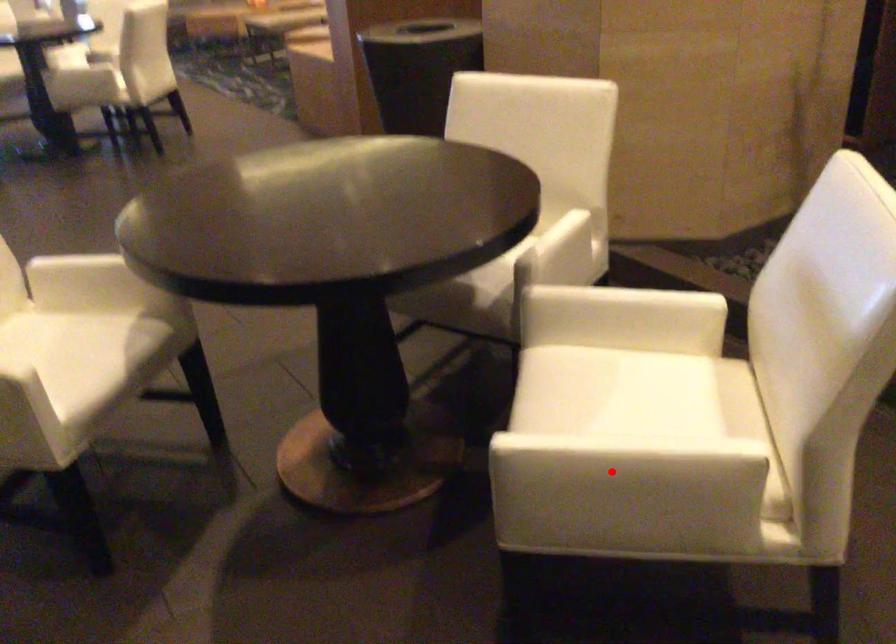
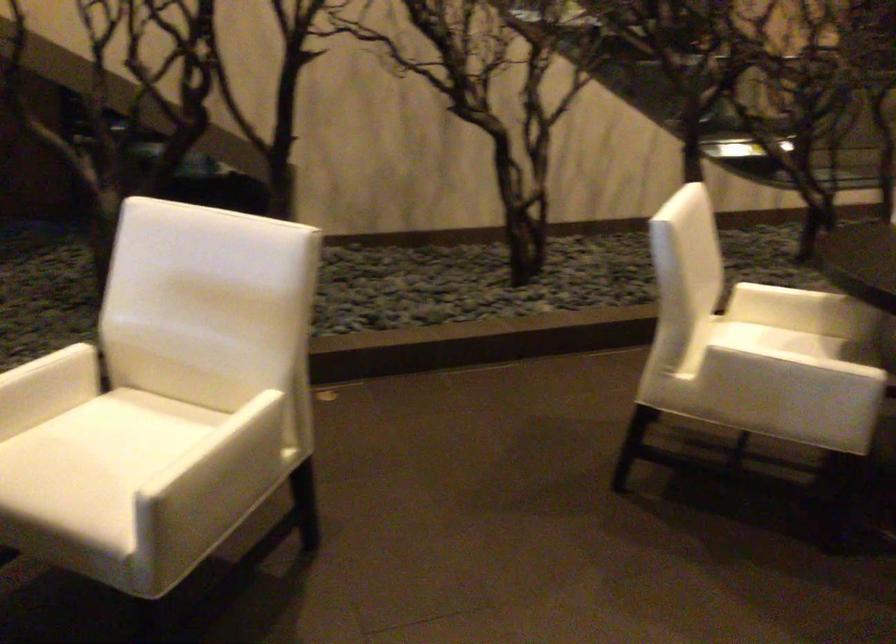
Find the pixel in the second image that matches the highlighted location in the first image.

(225, 462)